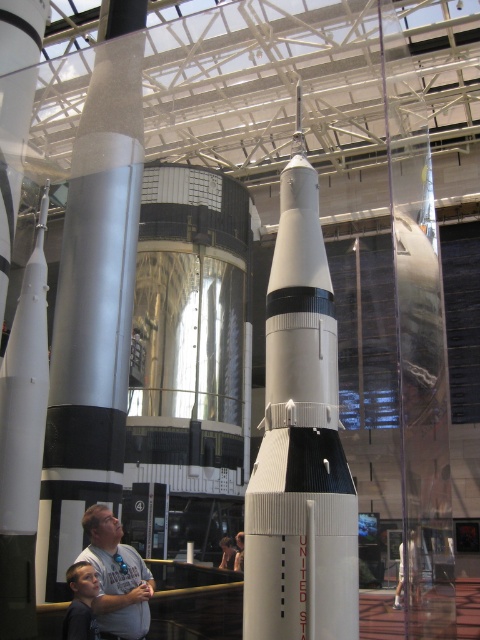
Question: Which point is closer to the camera taking this photo?

Choices:
 (A) (67, 577)
 (B) (117, 310)

Answer: (A)

Question: Considering the relative positions of light blue shirt at lower left and gray fabric shirt at lower center in the image provided, where is light blue shirt at lower left located with respect to gray fabric shirt at lower center?

Choices:
 (A) right
 (B) left

Answer: (B)

Question: Which point is farther from the camera taking this photo?

Choices:
 (A) (226, 563)
 (B) (99, 592)
 (C) (36, 561)
 (D) (334, 317)

Answer: (A)

Question: Based on their relative distances, which object is nearer to the gray fabric shirt at lower center?

Choices:
 (A) white matte rocket at center
 (B) light blue shirt at lower left

Answer: (B)

Question: Is light brown hair at lower left bigger than light brown leather jacket at center?

Choices:
 (A) no
 (B) yes

Answer: (B)

Question: Is white matte rocket at center bigger than light blue shirt at lower left?

Choices:
 (A) no
 (B) yes

Answer: (B)